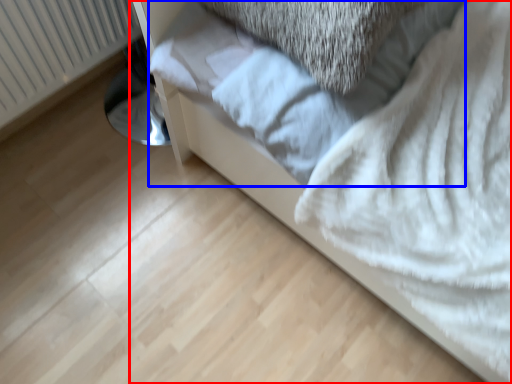
Question: Which point is further to the camera, furniture (highlighted by a red box) or sheet (highlighted by a blue box)?

Choices:
 (A) furniture
 (B) sheet

Answer: (B)